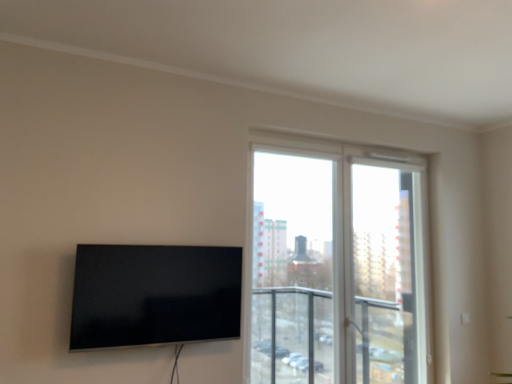
Question: From a real-world perspective, is transparent glass screen door at upper right physically located above or below transparent glass window at center?

Choices:
 (A) above
 (B) below

Answer: (A)

Question: Is transparent glass screen door at upper right in front of or behind transparent glass window at center in the image?

Choices:
 (A) front
 (B) behind

Answer: (B)

Question: Estimate the real-world distances between objects in this image. Which object is farther from the transparent glass window at center?

Choices:
 (A) transparent glass screen door at upper right
 (B) matte black tv at left

Answer: (B)

Question: Which of these objects is positioned closest to the transparent glass window at center?

Choices:
 (A) transparent glass screen door at upper right
 (B) matte black tv at left

Answer: (A)